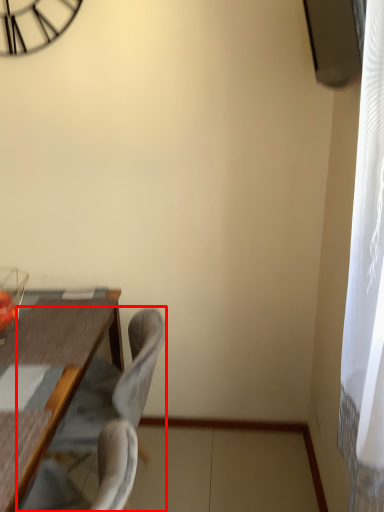
Question: In this image, where is chair (annotated by the red box) located relative to swivel chair?

Choices:
 (A) right
 (B) left

Answer: (A)